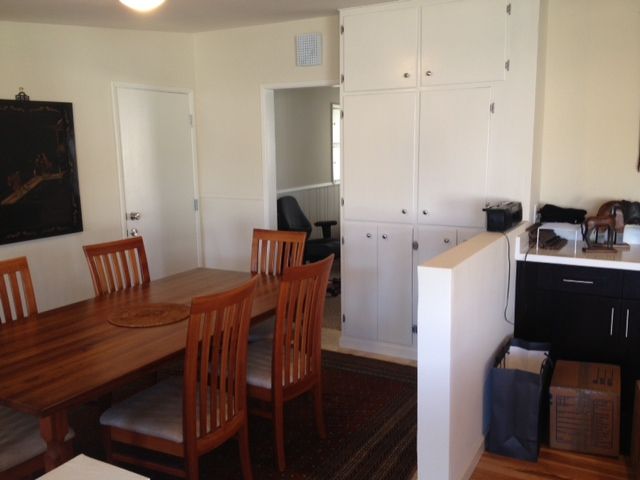
Where is `room`? This screenshot has height=480, width=640. room is located at coordinates (314, 175).